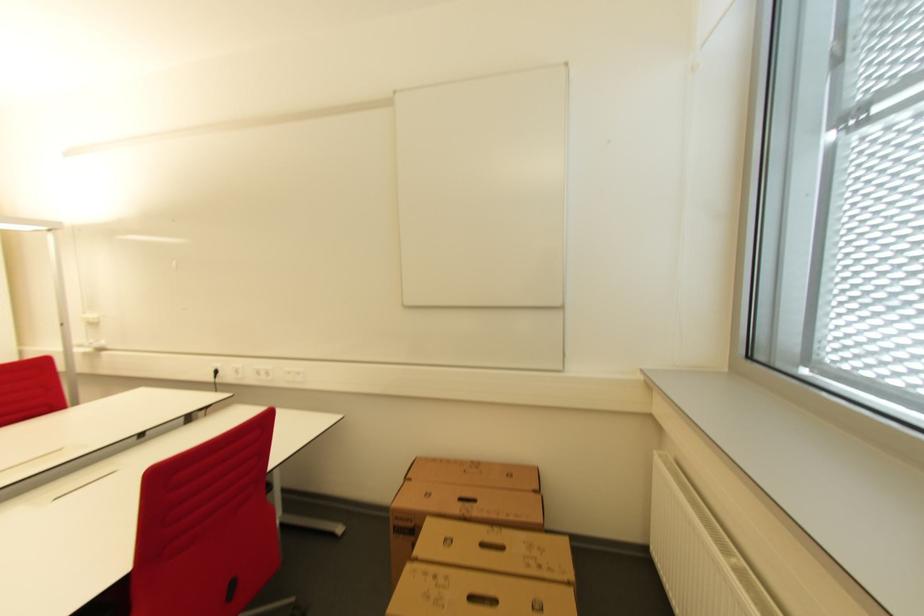
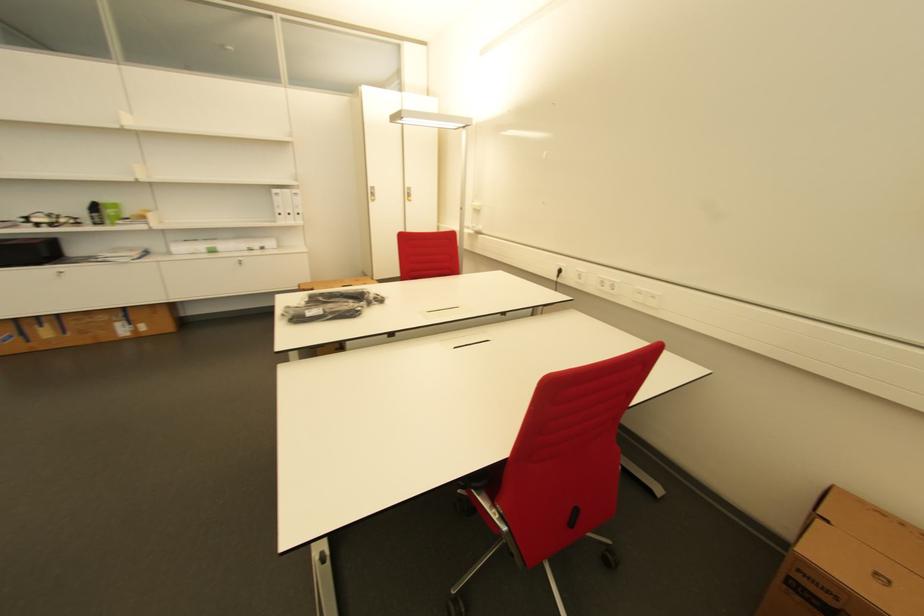
Find the pixel in the second image that matches [407,536] in the first image.

(805, 600)